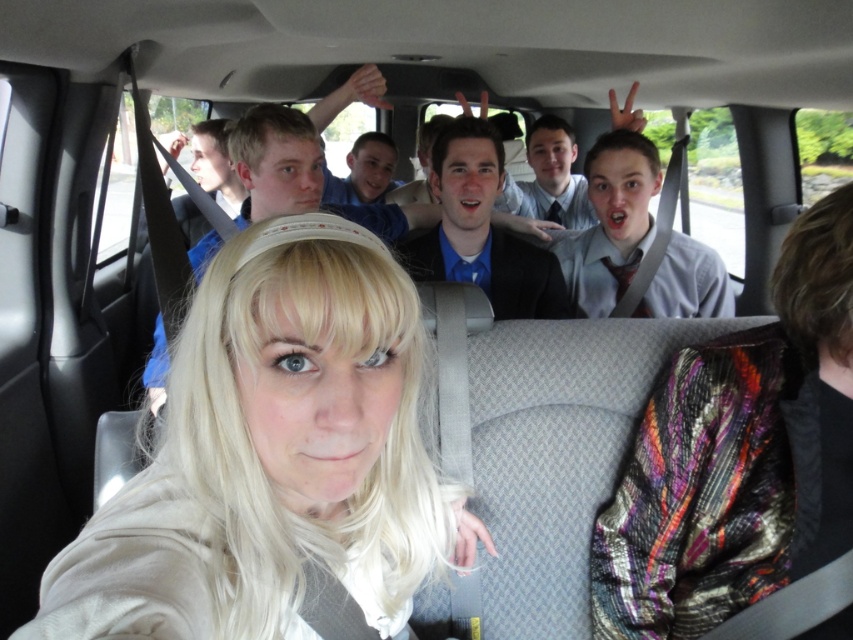
Question: Is blonde hair at center smaller than metallic sequined scarf at rear center?

Choices:
 (A) no
 (B) yes

Answer: (A)

Question: Is blonde hair at center wider than metallic sequined scarf at rear center?

Choices:
 (A) yes
 (B) no

Answer: (A)

Question: Which point is closer to the camera taking this photo?

Choices:
 (A) (788, 518)
 (B) (236, 593)

Answer: (B)

Question: Does blonde hair at center appear on the right side of metallic sequined scarf at rear center?

Choices:
 (A) yes
 (B) no

Answer: (B)

Question: Which of the following is the farthest from the observer?

Choices:
 (A) metallic sequined scarf at rear center
 (B) blonde hair at center

Answer: (A)